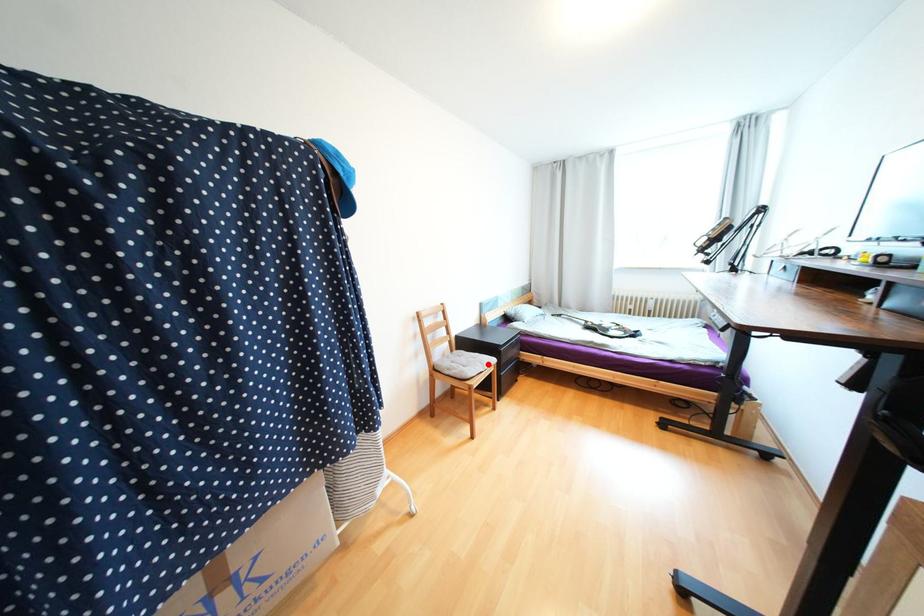
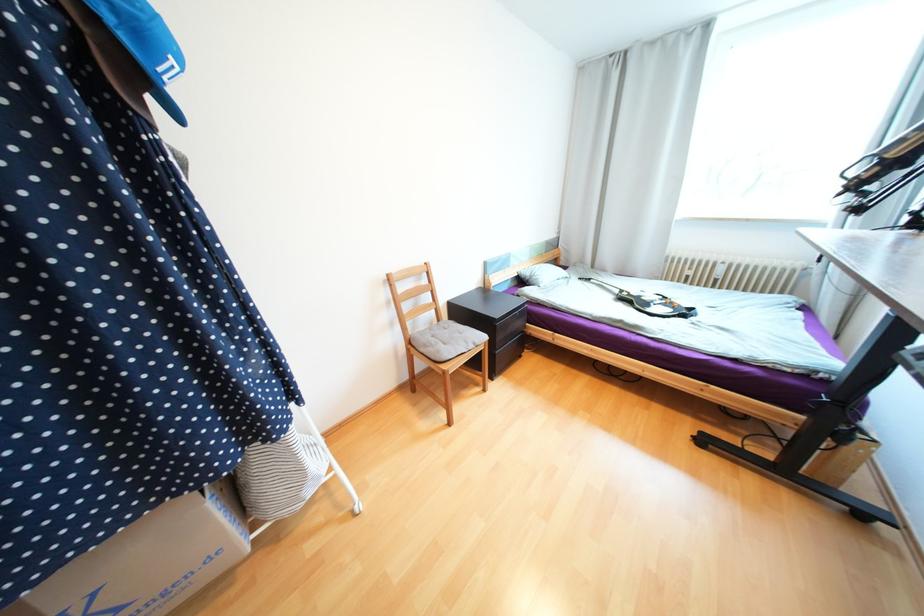
Question: I am providing you with two images of the same scene from different viewpoints. Image1 has a red point marked. In image2, the corresponding 3D location appears at what relative position? Reply with the corresponding letter.

Choices:
 (A) Closer
 (B) Farther

Answer: (A)